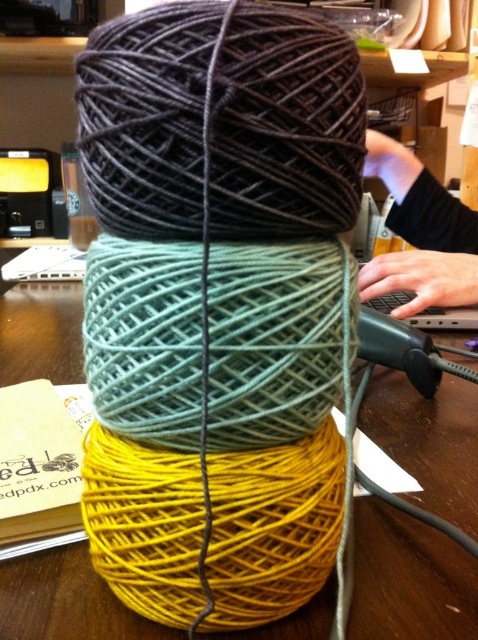
Question: Which of these objects is positioned closest to the dark brown yarn at upper center?

Choices:
 (A) black fabric at upper right
 (B) yellow matte yarn at center

Answer: (B)

Question: Is dark brown yarn at upper center bigger than yellow matte yarn at center?

Choices:
 (A) yes
 (B) no

Answer: (B)

Question: Which point is closer to the camera taking this photo?

Choices:
 (A) (354, 54)
 (B) (412, 468)
 (C) (456, 257)

Answer: (A)

Question: Which object is positioned closest to the dark brown yarn at upper center?

Choices:
 (A) black fabric at upper right
 (B) yellow matte yarn at center

Answer: (B)

Question: Is dark brown yarn at upper center positioned at the back of black fabric at upper right?

Choices:
 (A) yes
 (B) no

Answer: (B)

Question: Does yellow matte yarn at center appear under black fabric at upper right?

Choices:
 (A) no
 (B) yes

Answer: (B)